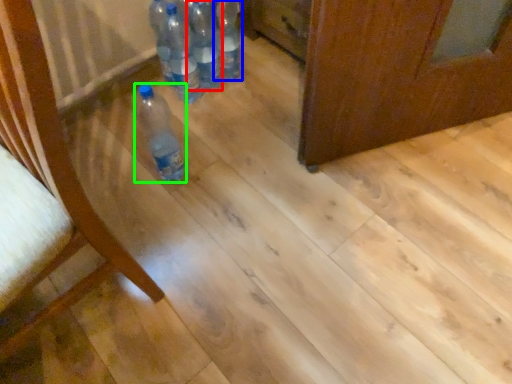
Question: Which is nearer to the bottle (highlighted by a red box)? bottle (highlighted by a blue box) or bottle (highlighted by a green box).

Choices:
 (A) bottle
 (B) bottle

Answer: (A)